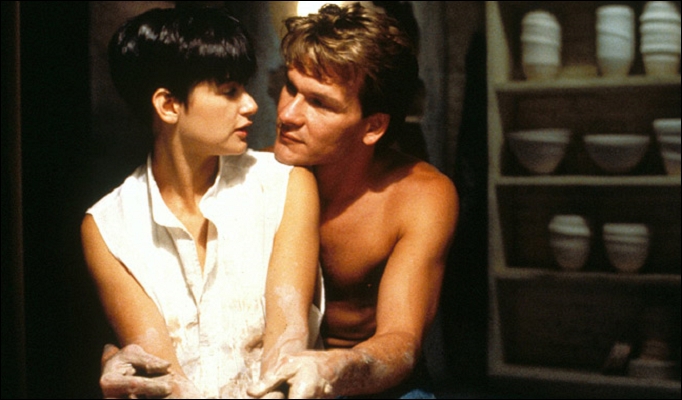
You are a GUI agent. You are given a task and a screenshot of the screen. Output one action in this format:
    pyautogui.click(x=<x>, y=<y>)
    Task: Click on the bowl
    
    Given the screenshot: What is the action you would take?
    pyautogui.click(x=629, y=162), pyautogui.click(x=542, y=159)